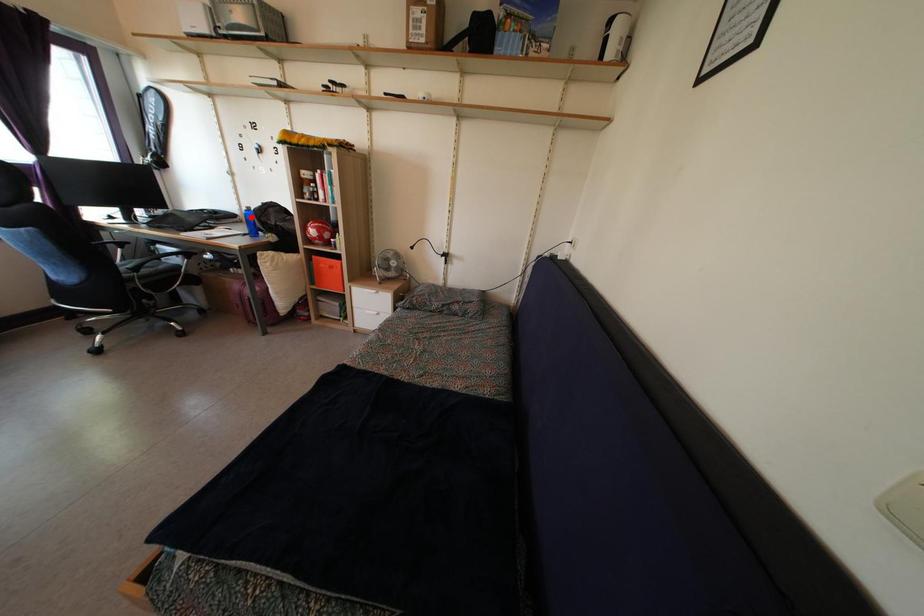
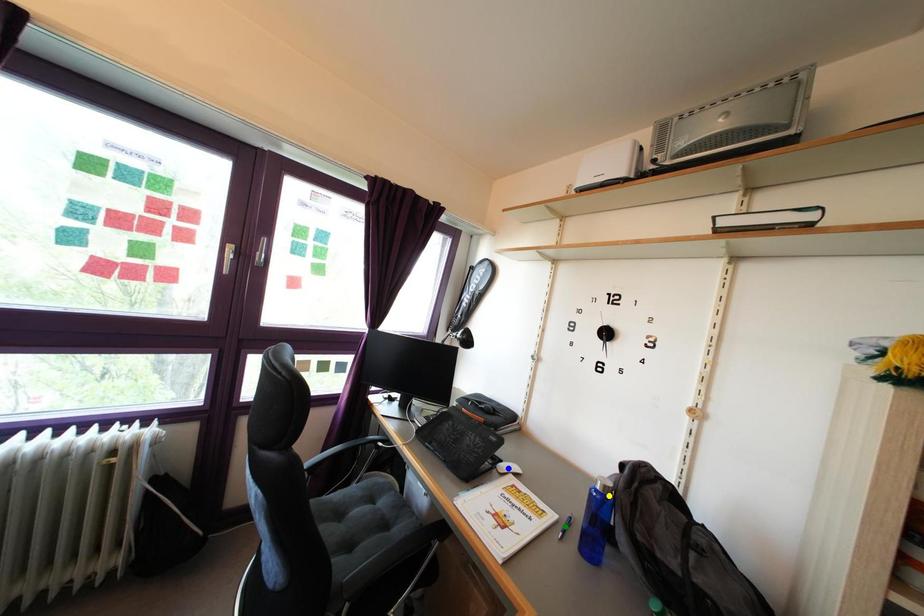
Question: I am providing you with two images of the same scene from different viewpoints. A red point is marked on the first image. You are given multiple points on the second image. Which spot in image 2 lines up with the point in image 1?

Choices:
 (A) yellow point
 (B) green point
 (C) blue point

Answer: (A)